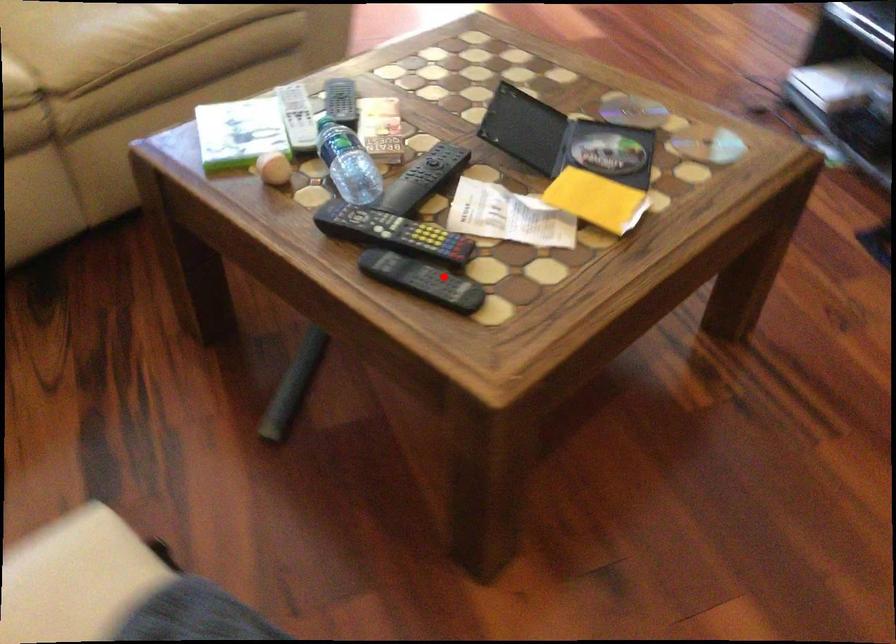
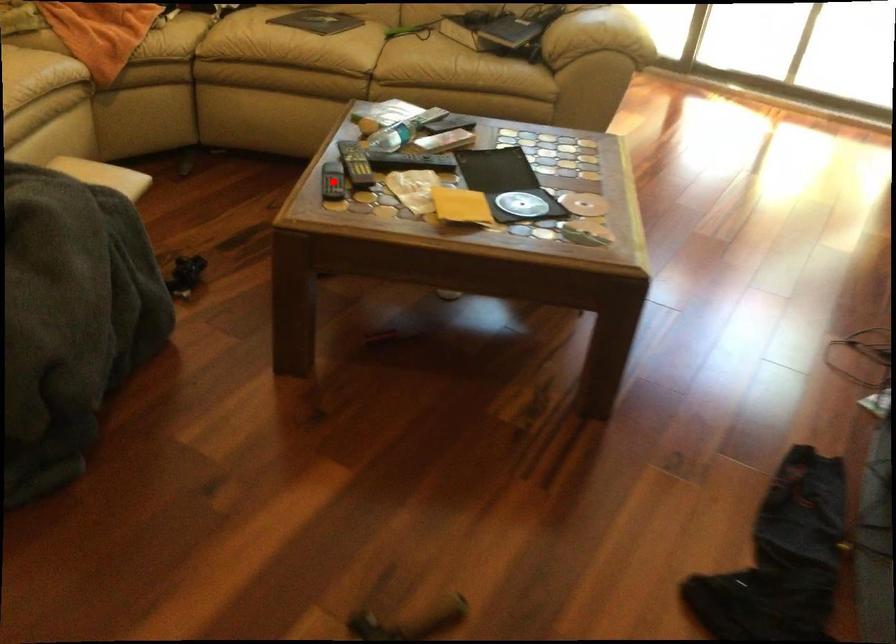
I am providing you with two images of the same scene from different viewpoints. A red point is marked on the first image and another point is marked on the second image. Is the red point in image1 aligned with the point shown in image2?

Yes